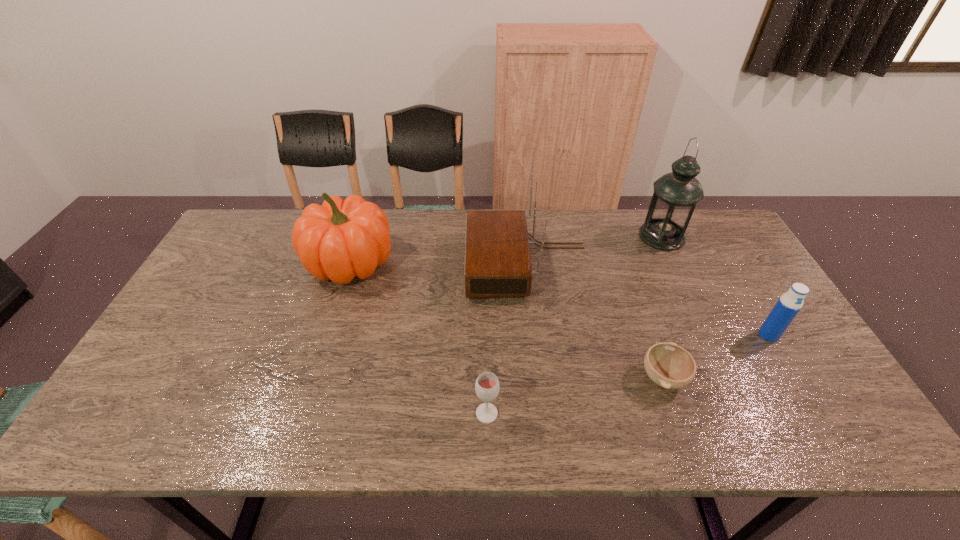
Image resolution: width=960 pixels, height=540 pixels. Identify the location of the fifth object from left to right. (676, 194).

This screenshot has width=960, height=540. I want to click on oil lamp, so click(x=676, y=194).

Image resolution: width=960 pixels, height=540 pixels. What are the coordinates of `radio_receiver` in the screenshot? It's located at (497, 256).

Find the location of a particular element. pumpkin is located at coordinates (339, 240).

Locate an element on the screen. the leftmost object is located at coordinates (339, 240).

In order to click on the third nearest object in this screenshot , I will do `click(789, 304)`.

The width and height of the screenshot is (960, 540). I want to click on the rightmost object, so click(x=789, y=304).

Identify the location of wineglass. The image size is (960, 540). (487, 384).

I want to click on the nearest object, so click(487, 384).

The height and width of the screenshot is (540, 960). What are the coordinates of `the shortest object` in the screenshot? It's located at tap(668, 365).